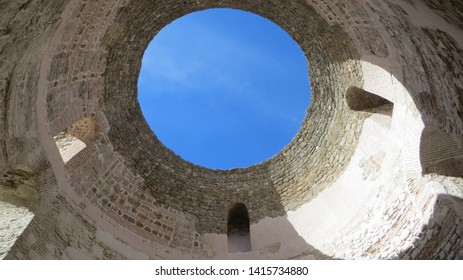
Find the location of a particular element. open window area is located at coordinates (73, 140), (234, 224), (368, 99).